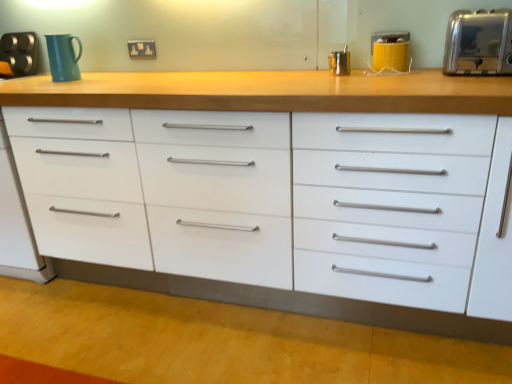
Where is `vacant region to the left of metallic silver container at upper center, which ranks as the 2th appliance in back-to-front order`? The height and width of the screenshot is (384, 512). vacant region to the left of metallic silver container at upper center, which ranks as the 2th appliance in back-to-front order is located at coordinates (301, 72).